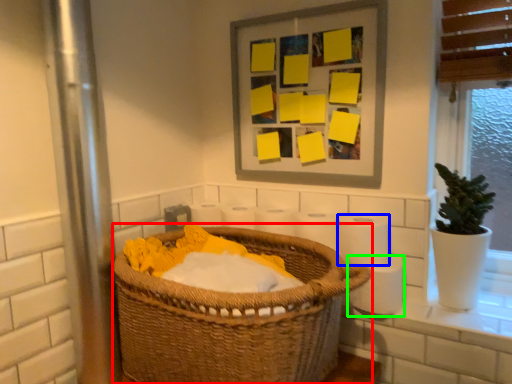
Question: Which is nearer to the basket (highlighted by a red box)? toilet paper (highlighted by a blue box) or toilet paper (highlighted by a green box).

Choices:
 (A) toilet paper
 (B) toilet paper

Answer: (A)